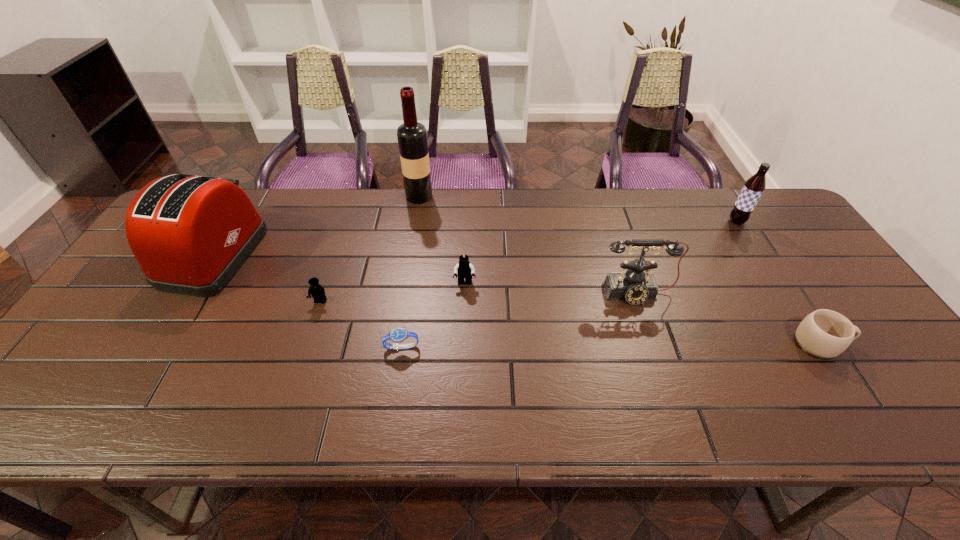
The image size is (960, 540). Find the location of `the farthest object`. the farthest object is located at coordinates (412, 136).

Locate an element on the screen. Image resolution: width=960 pixels, height=540 pixels. the tallest object is located at coordinates (412, 136).

At what (x,y) coordinates should I click in order to perform the action: click on toaster. Please return your answer as a coordinate pair (x, y). The height and width of the screenshot is (540, 960). Looking at the image, I should click on (190, 234).

I want to click on root beer, so click(753, 188).

What are the coordinates of `telephone` in the screenshot? It's located at (634, 286).

This screenshot has height=540, width=960. Find the location of `the farther Lego`. the farther Lego is located at coordinates (464, 269).

At what (x,y) coordinates should I click in order to perform the action: click on the right Lego. Please return your answer as a coordinate pair (x, y). Looking at the image, I should click on (464, 269).

At what (x,y) coordinates should I click in order to perform the action: click on the shorter Lego. Please return your answer as a coordinate pair (x, y). This screenshot has height=540, width=960. Looking at the image, I should click on (316, 290).

This screenshot has height=540, width=960. What are the coordinates of `the nearer Lego` in the screenshot? It's located at (316, 290).

Locate an element on the screen. The height and width of the screenshot is (540, 960). mug is located at coordinates (824, 334).